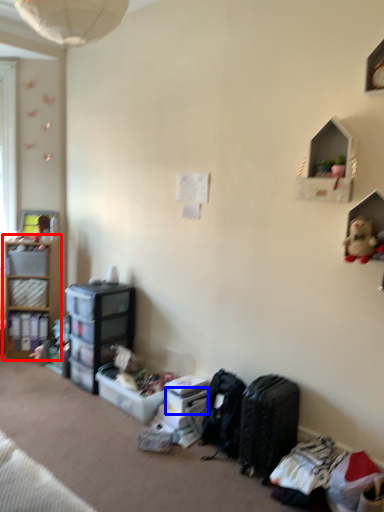
Question: Among these objects, which one is farthest to the camera, shelf (highlighted by a red box) or storage box (highlighted by a blue box)?

Choices:
 (A) shelf
 (B) storage box

Answer: (A)